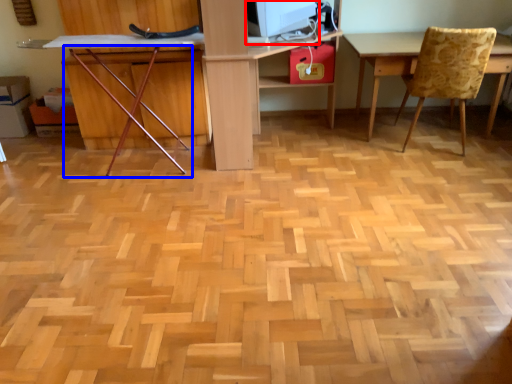
Question: Which of the following is the farthest to the observer, computer monitor (highlighted by a red box) or chair (highlighted by a blue box)?

Choices:
 (A) computer monitor
 (B) chair

Answer: (A)